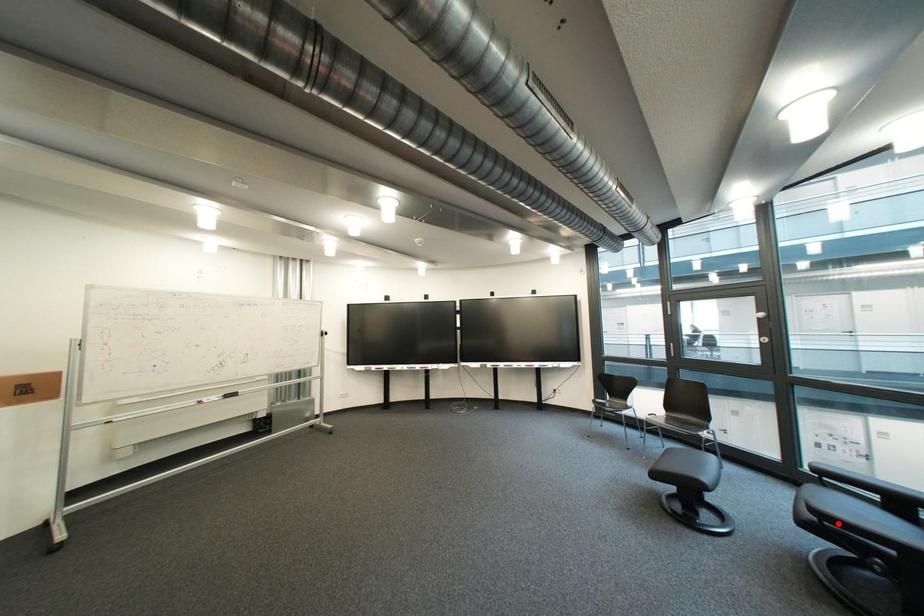
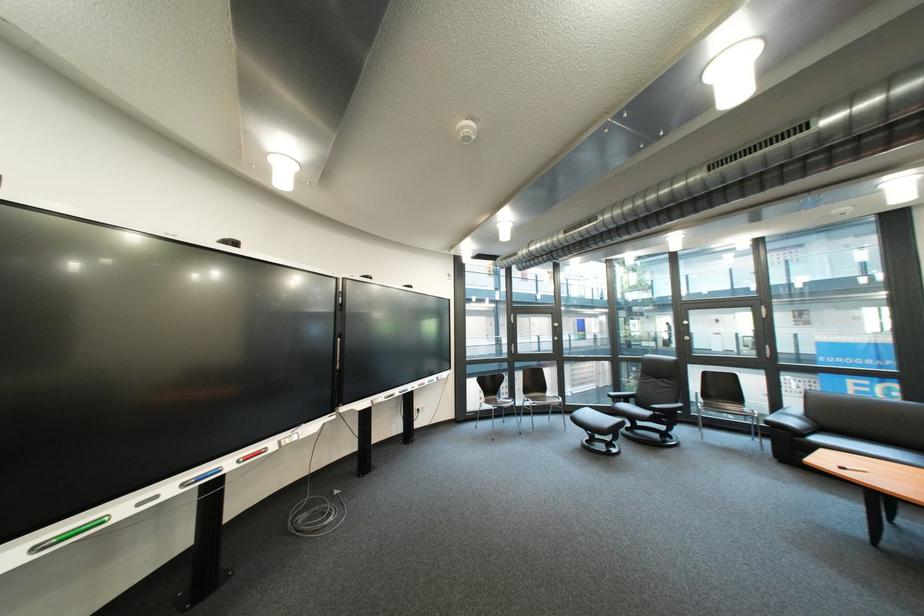
The point at the highlighted location is marked in the first image. Where is the corresponding point in the second image?

(670, 415)